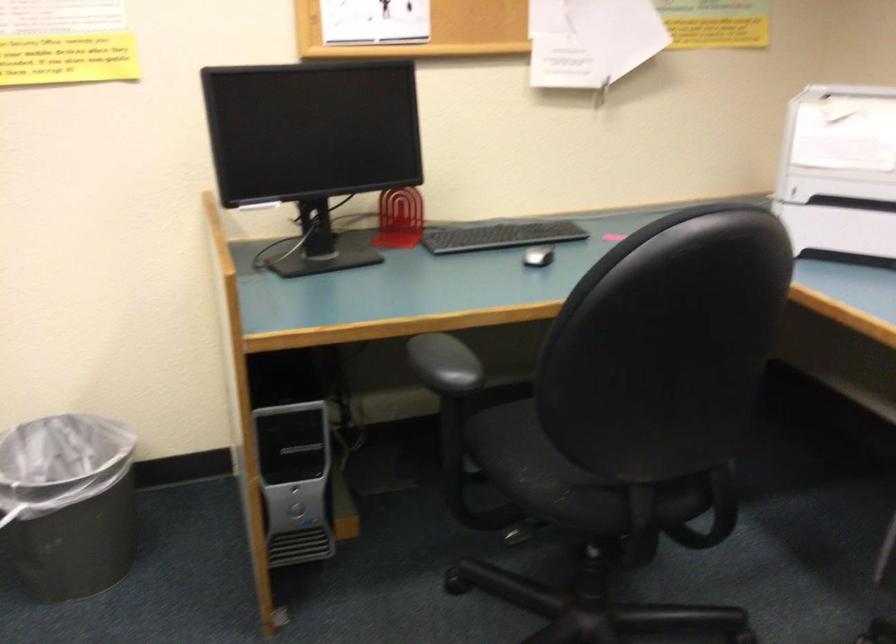
The image size is (896, 644). Describe the element at coordinates (841, 129) in the screenshot. I see `the printer lid` at that location.